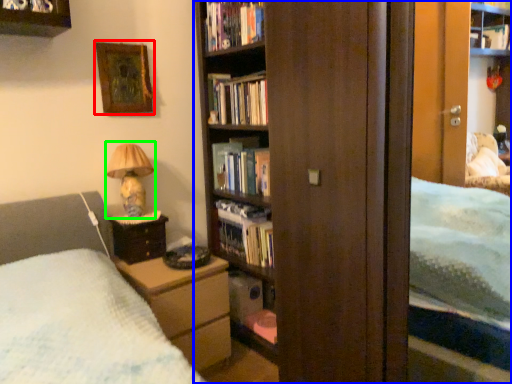
Question: Which is nearer to the picture frame (highlighted by a red box)? bookcase (highlighted by a blue box) or table lamp (highlighted by a green box).

Choices:
 (A) bookcase
 (B) table lamp

Answer: (B)